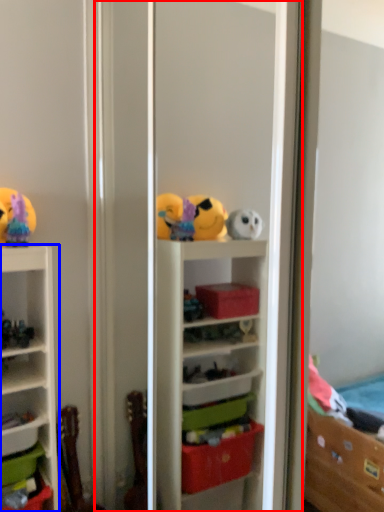
Question: Among these objects, which one is farthest to the camera, screen door (highlighted by a red box) or shelf (highlighted by a blue box)?

Choices:
 (A) screen door
 (B) shelf

Answer: (B)